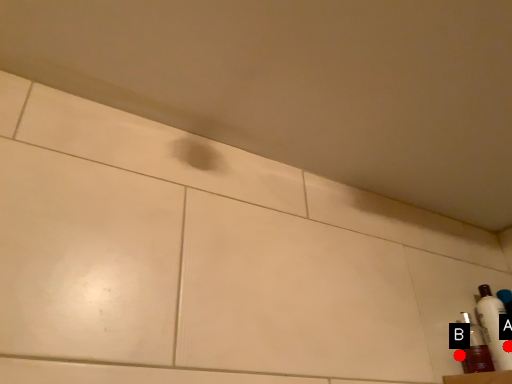
Question: Two points are circled on the image, labeled by A and B beside each circle. Which point appears closest to the camera in this image?

Choices:
 (A) A is closer
 (B) B is closer

Answer: (A)